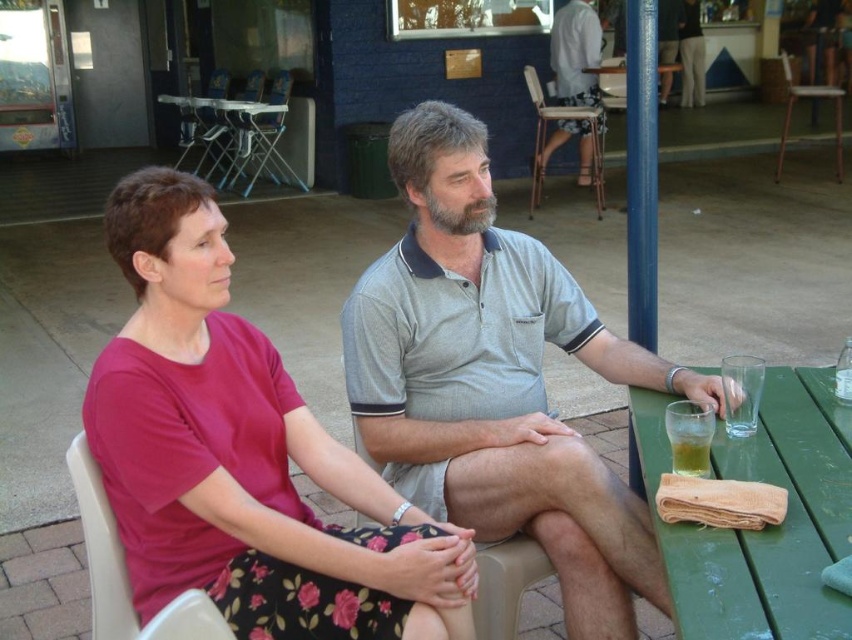
Question: Observing the image, what is the correct spatial positioning of green plastic picnic table at upper left in reference to translucent glass at table right?

Choices:
 (A) left
 (B) right

Answer: (A)

Question: Does green plastic picnic table at upper left have a lesser width compared to gray cotton shirt at upper center?

Choices:
 (A) no
 (B) yes

Answer: (A)

Question: Which object appears closest to the camera in this image?

Choices:
 (A) green wood table at lower right
 (B) green plastic picnic table at upper left

Answer: (A)

Question: Based on their relative distances, which object is nearer to the green plastic picnic table at upper left?

Choices:
 (A) gray cotton shirt at upper center
 (B) pink fabric dress at center
 (C) green wood table at lower right
 (D) gray cotton shirt at center

Answer: (A)

Question: Which object appears closest to the camera in this image?

Choices:
 (A) green wood table at lower right
 (B) pink fabric dress at center

Answer: (A)

Question: Can you confirm if pink fabric dress at center is positioned to the right of translucent glass at table right?

Choices:
 (A) yes
 (B) no

Answer: (B)